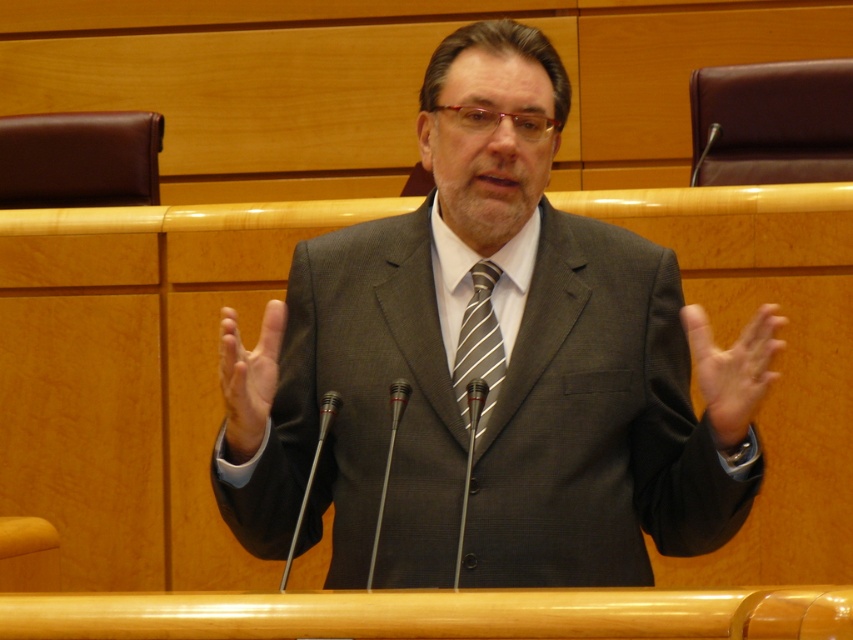
You are a tailor who needs to ensure proper fit for the matte gray suit at center and the matte gray hand at center. Which object is wider?

The matte gray suit at center is wider than the matte gray hand at center according to the description.

You are a photographer setting up for a formal event. You notice two hands, the smooth skin hand at center and the matte gray hand at center, in the frame. Which hand should you adjust your focus to ensure the wider one is in sharp detail?

The smooth skin hand at center might be wider than matte gray hand at center, so you should focus on the smooth skin hand at center to ensure the wider one is in sharp detail.